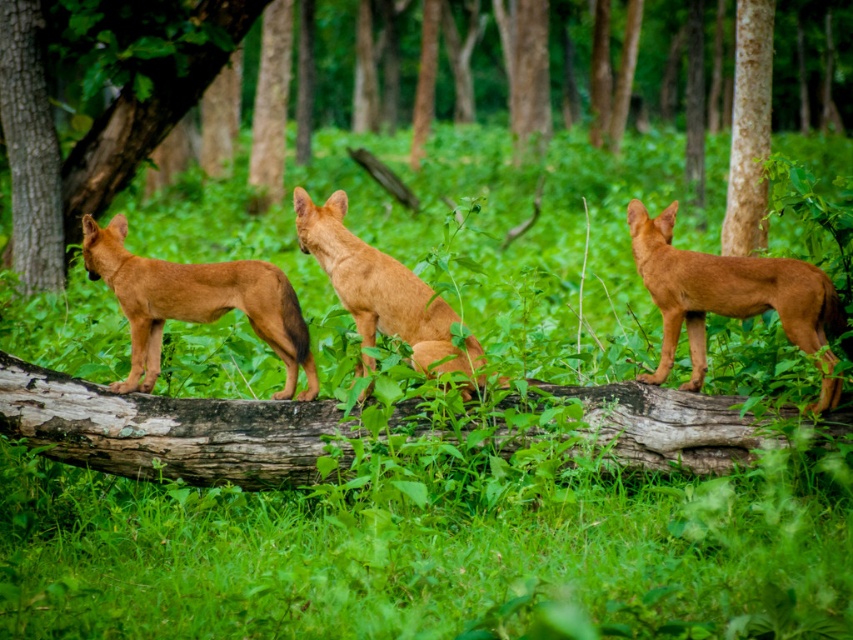
You are an animal tracker trying to locate the green rough bark tree at left in the forest scene. Based on the coordinates provided, where would you find it in the image?

The green rough bark tree at left is located at the coordinates point [94,124] in the image.

You are a photographer trying to capture the brown furry dog at center and the green rough bark tree at left in the same frame. Based on their widths, which one would require you to zoom out more to include its entire structure in the photo?

The green rough bark tree at left requires zooming out more because its width surpasses that of the brown furry dog at center, meaning it occupies more space in the frame.